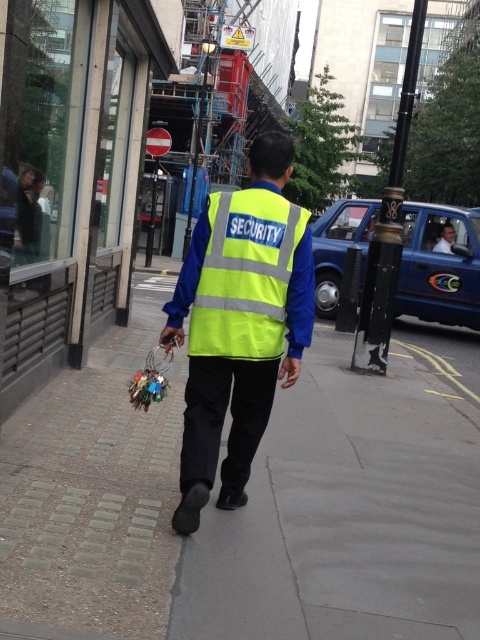
Does high-visibility fabric security vest at center appear over yellow reflective vest at center?

Answer: No, high-visibility fabric security vest at center is not above yellow reflective vest at center.

Which is behind, point (244, 208) or point (256, 237)?

The point (244, 208) is more distant.

The width and height of the screenshot is (480, 640). Find the location of `high-visibility fabric security vest at center`. high-visibility fabric security vest at center is located at coordinates (240, 323).

You are a GUI agent. You are given a task and a screenshot of the screen. Output one action in this format:
    pyautogui.click(x=<x>, y=<y>)
    Task: Click on the high-visibility fabric security vest at center
    The image size is (480, 640).
    Given the screenshot: What is the action you would take?
    pos(240,323)

Which of these two, brick paved sidewalk at center or high-visibility fabric security vest at center, stands shorter?

Standing shorter between the two is brick paved sidewalk at center.

Does brick paved sidewalk at center have a greater height compared to high-visibility fabric security vest at center?

No.

Locate an element on the screen. brick paved sidewalk at center is located at coordinates (243, 508).

Locate an element on the screen. The width and height of the screenshot is (480, 640). brick paved sidewalk at center is located at coordinates (243, 508).

Does brick paved sidewalk at center have a larger size compared to yellow reflective vest at center?

Yes.

Measure the distance between point (88, 486) and camera.

Point (88, 486) is 3.43 meters away from camera.

Image resolution: width=480 pixels, height=640 pixels. What are the coordinates of `brick paved sidewalk at center` in the screenshot? It's located at (243, 508).